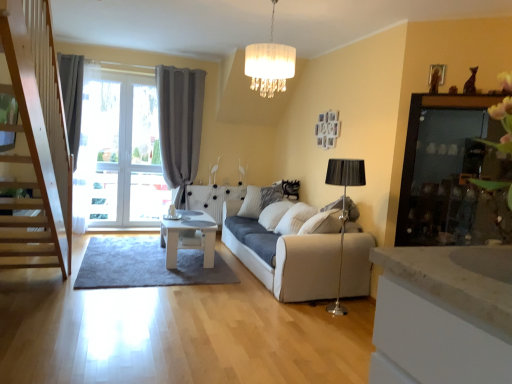
This screenshot has width=512, height=384. What do you see at coordinates (269, 64) in the screenshot?
I see `white fabric chandelier at upper center` at bounding box center [269, 64].

Where is `transparent glass screen door at upper right`? This screenshot has width=512, height=384. transparent glass screen door at upper right is located at coordinates (432, 169).

Identify the location of white glossy table at center. (189, 237).

Where is `gray fabric curtain at left`? This screenshot has height=384, width=512. gray fabric curtain at left is located at coordinates (180, 125).

What do you see at coordinates (260, 199) in the screenshot? I see `white textured pillow at center` at bounding box center [260, 199].

You are a GUI agent. You are given a task and a screenshot of the screen. Output one action in this format:
    pyautogui.click(x=<x>, y=<y>)
    Task: Click on the white fabric chandelier at upper center
    This screenshot has height=384, width=512.
    Given the screenshot: What is the action you would take?
    pyautogui.click(x=269, y=64)

How many degrees apart are the facing directions of gray fabric curtain at left and white fabric studio couch at center?

87.6 degrees separate the facing orientations of gray fabric curtain at left and white fabric studio couch at center.

Which is in front, point (163, 148) or point (227, 230)?

Positioned in front is point (227, 230).

Is gray fabric curtain at left far away from white fabric studio couch at center?

That's right, there is a large distance between gray fabric curtain at left and white fabric studio couch at center.

What's the angular difference between white glossy table at center and white fabric studio couch at center's facing directions?

There is a 1.16-degree angle between the facing directions of white glossy table at center and white fabric studio couch at center.

Is white glossy table at center facing away from white fabric studio couch at center?

Yes, white fabric studio couch at center is at the back of white glossy table at center.

Between white glossy table at center and white fabric studio couch at center, which one is positioned behind?

white glossy table at center is further away from the camera.

From the image's perspective, does white glossy table at center appear higher than white fabric studio couch at center?

No.

From a real-world perspective, does gray fabric curtain at left stand above white textured pillow at center?

Yes, from a real-world perspective, gray fabric curtain at left is over white textured pillow at center

Identify the location of curtain lying above the white textured pillow at center (from the image's perspective). Image resolution: width=512 pixels, height=384 pixels. (180, 125).

In the scene shown: Can you confirm if gray fabric curtain at left is smaller than white textured pillow at center?

No.

Consider the image. Is white fabric chandelier at upper center looking in the opposite direction of white glossy table at center?

No, white fabric chandelier at upper center's orientation is not away from white glossy table at center.

Considering the points (273, 85) and (189, 238), which point is behind, point (273, 85) or point (189, 238)?

Point (189, 238)

Who is shorter, white fabric chandelier at upper center or white glossy table at center?

white glossy table at center is shorter.

Is white glossy table at center taller or shorter than white fabric chandelier at upper center?

white glossy table at center is shorter than white fabric chandelier at upper center.

Considering the relative sizes of white glossy table at center and white fabric chandelier at upper center in the image provided, is white glossy table at center wider than white fabric chandelier at upper center?

Yes, white glossy table at center is wider than white fabric chandelier at upper center.

From a real-world perspective, between white glossy table at center and white fabric chandelier at upper center, who is vertically higher?

white fabric chandelier at upper center, from a real-world perspective.

Considering the points (203, 266) and (283, 69), which point is in front, point (203, 266) or point (283, 69)?

The point (283, 69) is closer.

Considering the positions of points (173, 233) and (177, 91), is point (173, 233) closer to camera compared to point (177, 91)?

Yes, point (173, 233) is closer to viewer.

Which object is thinner, white glossy table at center or gray fabric curtain at left?

With smaller width is gray fabric curtain at left.

From a real-world perspective, is white glossy table at center on top of gray fabric curtain at left?

No, from a real-world perspective, white glossy table at center is not on top of gray fabric curtain at left.

How distant is white glossy table at center from gray fabric curtain at left?

white glossy table at center and gray fabric curtain at left are 1.95 meters apart.

Considering their positions, is transparent glass screen door at upper right located in front of or behind white fabric studio couch at center?

transparent glass screen door at upper right is in front of white fabric studio couch at center.

Is transparent glass screen door at upper right not near white fabric studio couch at center?

transparent glass screen door at upper right is positioned a significant distance from white fabric studio couch at center.

Is transparent glass screen door at upper right at the right side of white fabric studio couch at center?

Correct, you'll find transparent glass screen door at upper right to the right of white fabric studio couch at center.

Does transparent glass screen door at upper right turn towards white fabric studio couch at center?

No, transparent glass screen door at upper right is not aimed at white fabric studio couch at center.

Where is `studio couch lying below the gray fabric curtain at left (from the image's perspective)`? studio couch lying below the gray fabric curtain at left (from the image's perspective) is located at coordinates (285, 257).

Identify the location of studio couch above the white glossy table at center (from the image's perspective). (285, 257).

From the image, which object appears to be farther from gray fabric curtain at left, white glossy table at center or white fabric chandelier at upper center?

Among the two, white fabric chandelier at upper center is located further to gray fabric curtain at left.

Based on their spatial positions, is white glossy table at center or white fabric studio couch at center further from white fabric chandelier at upper center?

white glossy table at center is further to white fabric chandelier at upper center.

Considering their positions, is white fabric chandelier at upper center positioned closer to gray fabric curtain at left than white fabric studio couch at center?

white fabric studio couch at center is closer to gray fabric curtain at left.

Estimate the real-world distances between objects in this image. Which object is closer to transparent glass screen door at upper right, white fabric chandelier at upper center or white glossy table at center?

Based on the image, white fabric chandelier at upper center appears to be nearer to transparent glass screen door at upper right.

Considering their positions, is white fabric studio couch at center positioned closer to transparent glass screen door at upper right than white fabric chandelier at upper center?

white fabric studio couch at center lies closer to transparent glass screen door at upper right than the other object.

Looking at the image, which one is located further to white fabric studio couch at center, white glossy table at center or white textured pillow at center?

white textured pillow at center is further to white fabric studio couch at center.

Looking at the image, which one is located closer to gray fabric curtain at left, white fabric chandelier at upper center or white textured pillow at center?

Among the two, white textured pillow at center is located nearer to gray fabric curtain at left.

Which object lies further to the anchor point white fabric chandelier at upper center, white glossy table at center or gray fabric curtain at left?

Among the two, gray fabric curtain at left is located further to white fabric chandelier at upper center.

You are a GUI agent. You are given a task and a screenshot of the screen. Output one action in this format:
    pyautogui.click(x=<x>, y=<y>)
    Task: Click on the studio couch located between transparent glass screen door at upper right and gray fabric curtain at left in the depth direction
    This screenshot has width=512, height=384.
    Given the screenshot: What is the action you would take?
    pyautogui.click(x=285, y=257)

Image resolution: width=512 pixels, height=384 pixels. Find the location of `studio couch between white fabric chandelier at upper center and white textured pillow at center in the front-back direction`. studio couch between white fabric chandelier at upper center and white textured pillow at center in the front-back direction is located at coordinates (285, 257).

Identify the location of table between white fabric chandelier at upper center and gray fabric curtain at left from front to back. click(x=189, y=237).

Locate an element on the screen. Image resolution: width=512 pixels, height=384 pixels. lamp between transparent glass screen door at upper right and white textured pillow at center from front to back is located at coordinates (269, 64).